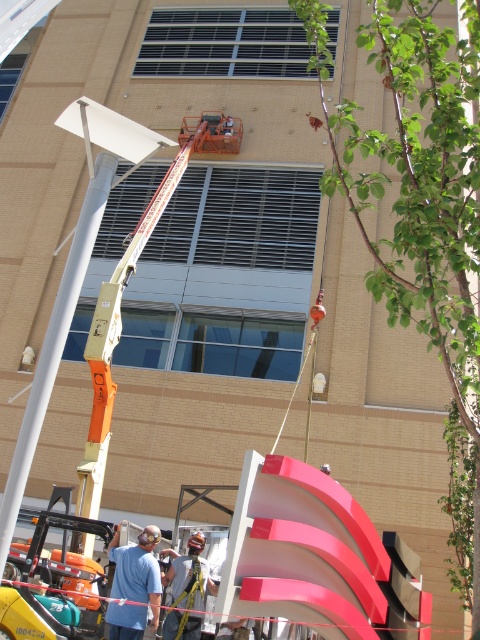
What do you see at coordinates (133, 584) in the screenshot?
I see `blue cotton shirt at lower left` at bounding box center [133, 584].

Between point (133, 552) and point (170, 628), which one is positioned in front?

Positioned in front is point (133, 552).

At what (x,y) coordinates should I click in order to perform the action: click on blue cotton shirt at lower left. Please return your answer as a coordinate pair (x, y). The width and height of the screenshot is (480, 640). Looking at the image, I should click on (133, 584).